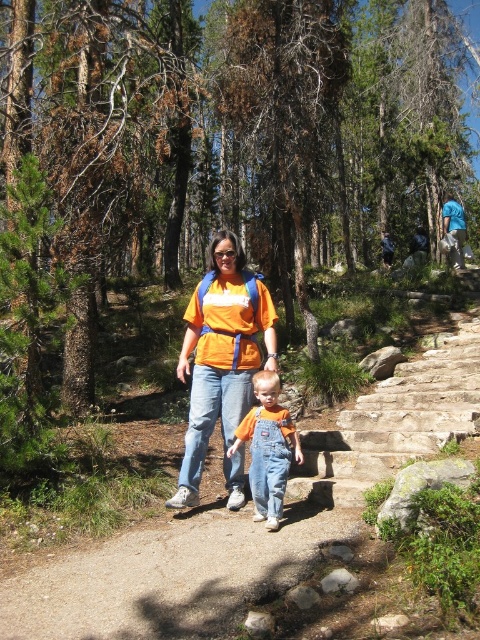
Which is more to the right, smooth concrete path at center or orange cotton shirt at center?

From the viewer's perspective, smooth concrete path at center appears more on the right side.

Consider the image. Which of these two, smooth concrete path at center or orange cotton shirt at center, stands shorter?

Standing shorter between the two is smooth concrete path at center.

Between point (396, 380) and point (264, 387), which one is positioned behind?

Positioned behind is point (396, 380).

Where is `smooth concrete path at center`? This screenshot has height=640, width=480. smooth concrete path at center is located at coordinates (241, 525).

Is smooth concrete path at center to the left of orange t-shirt at center from the viewer's perspective?

Incorrect, smooth concrete path at center is not on the left side of orange t-shirt at center.

This screenshot has height=640, width=480. Find the location of `smooth concrete path at center`. smooth concrete path at center is located at coordinates (241, 525).

Find the location of a particular element. The image size is (480, 640). smooth concrete path at center is located at coordinates (241, 525).

Does orange t-shirt at center appear on the right side of orange cotton shirt at center?

No, orange t-shirt at center is not to the right of orange cotton shirt at center.

Can you confirm if orange t-shirt at center is positioned below orange cotton shirt at center?

No, orange t-shirt at center is not below orange cotton shirt at center.

The height and width of the screenshot is (640, 480). Identify the location of orange t-shirt at center. (222, 362).